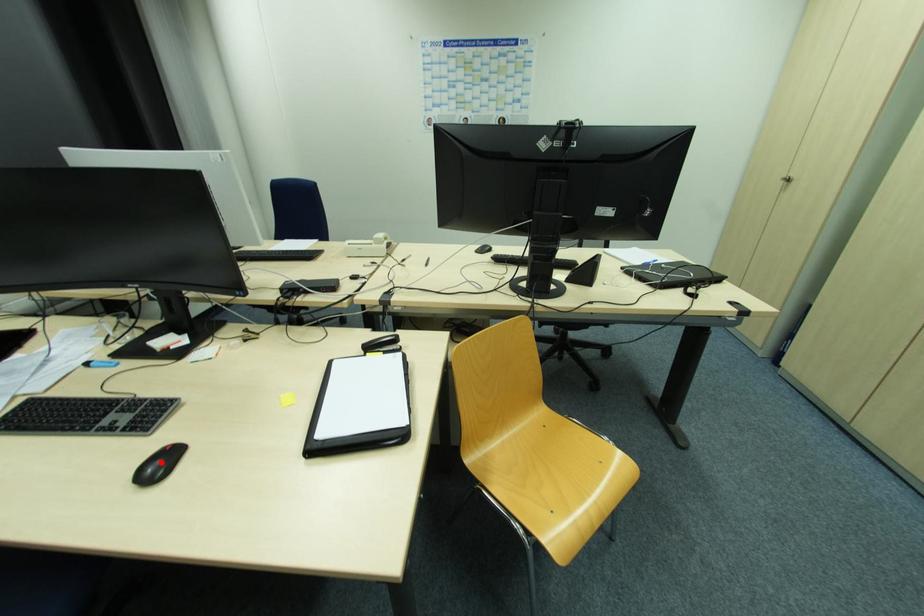
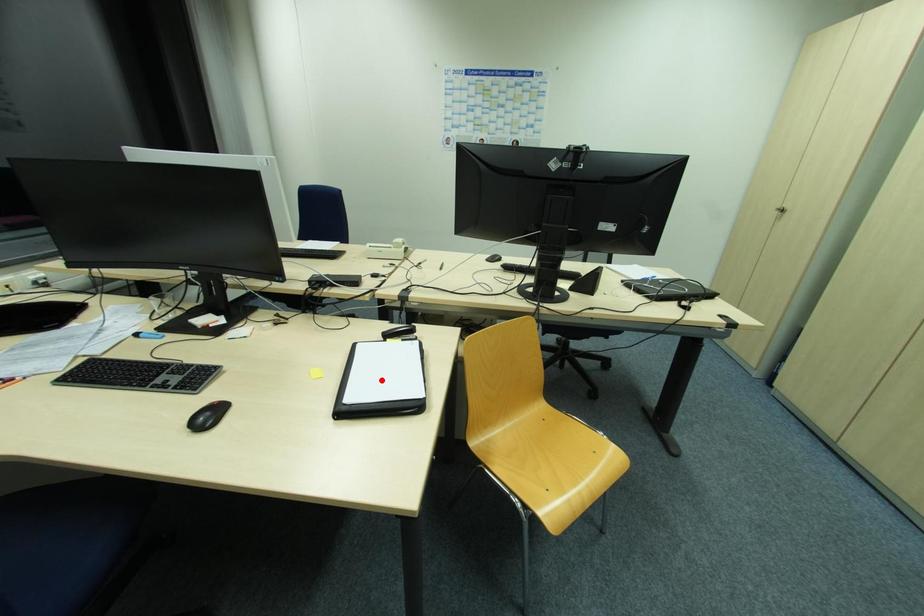
I am providing you with two images of the same scene from different viewpoints. A red point is marked on the first image and another point is marked on the second image. Do the highlighted points in image1 and image2 indicate the same real-world spot?

No